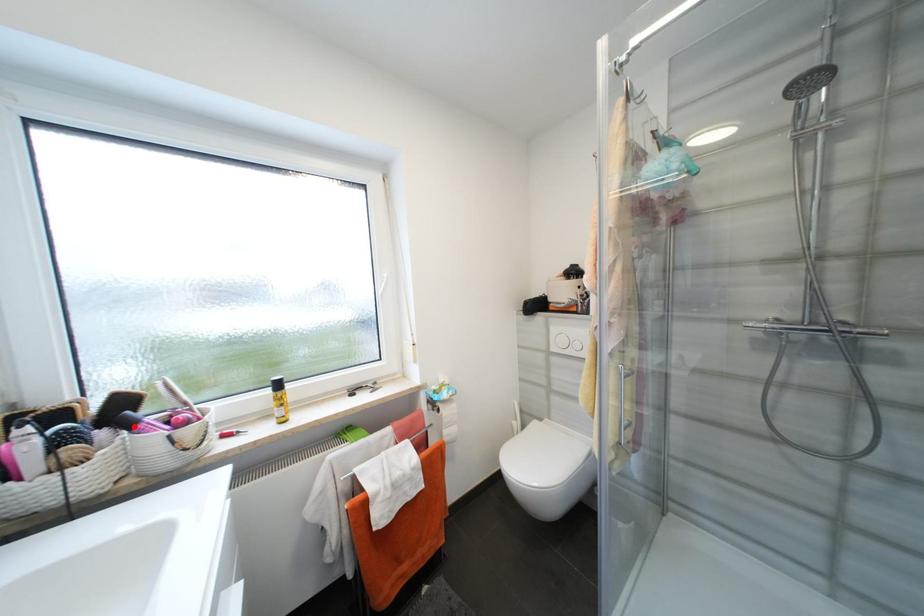
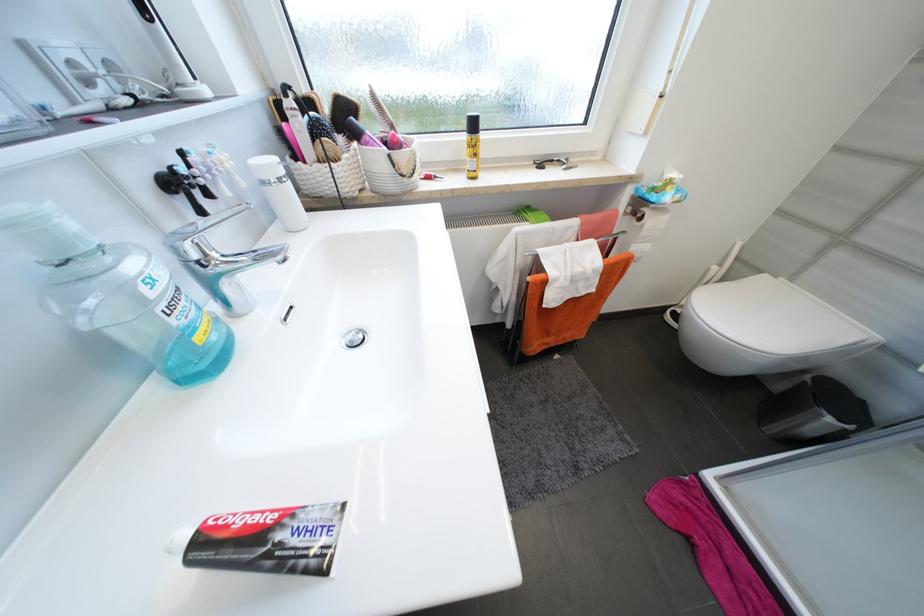
The point at the highlighted location is marked in the first image. Where is the corresponding point in the second image?

(362, 136)